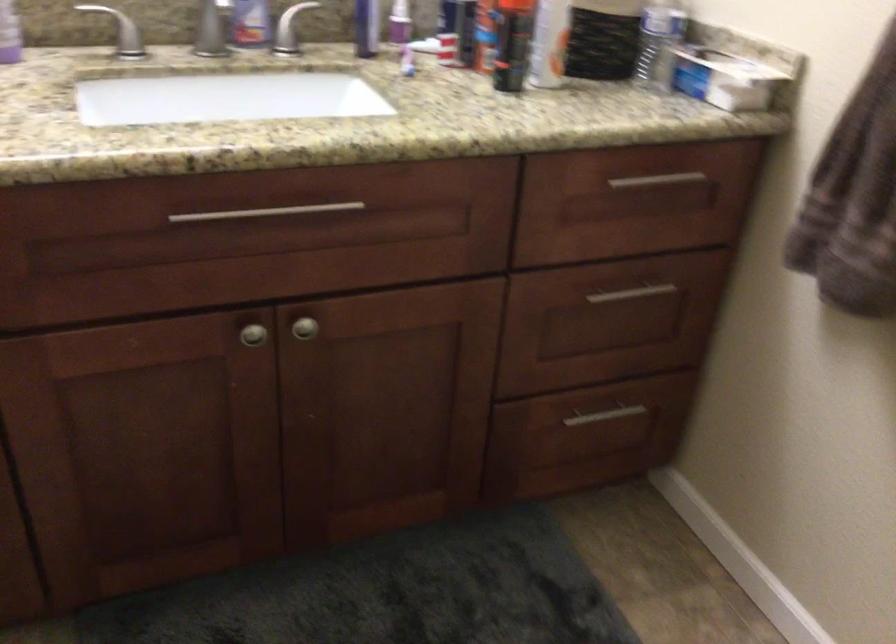
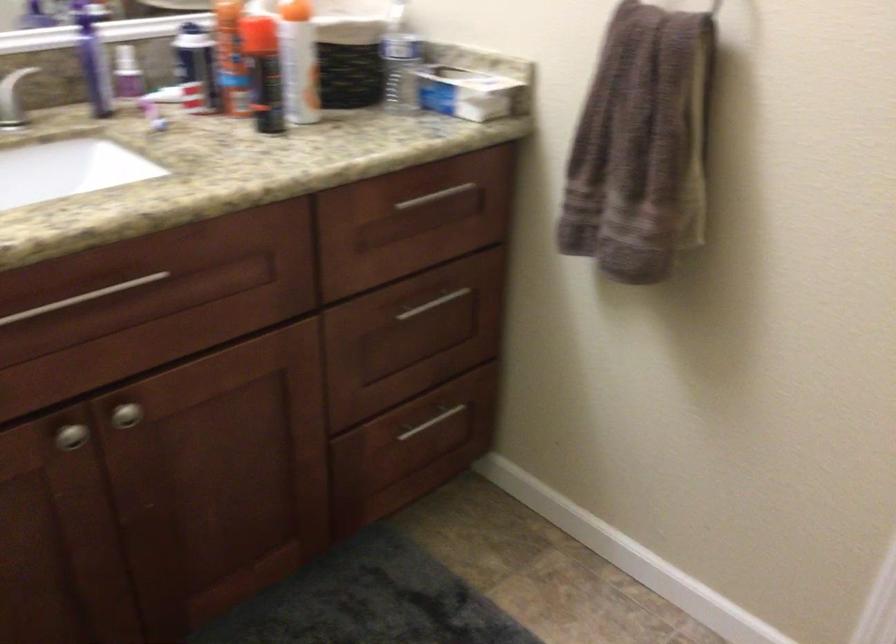
The point at (299, 328) is marked in the first image. Where is the corresponding point in the second image?

(125, 415)